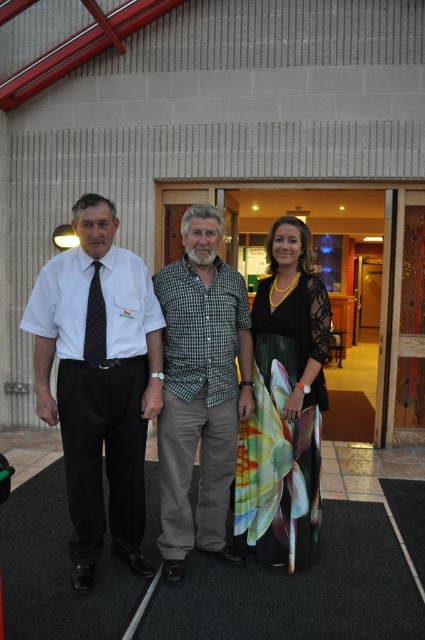
You are planning to take a photo of the group. The camera has a 1.2 meter wide frame. The white shirt at left and the floral silk dress at center are the main subjects. Based on their widths, will both fit within the frame if positioned side by side?

The white shirt at left might be wider than the floral silk dress at center, so their combined width could exceed the camera frame of 1.2 meters. It is uncertain if they will fit without overlapping or cropping.

You are a photographer setting up for a group photo. You notice the green checkered shirt at center and the floral silk dress at center. Which clothing item should you adjust to ensure both are fully visible in the photo?

The green checkered shirt at center is in front of the floral silk dress at center, so you should move the green checkered shirt at center slightly backward to allow both to be fully visible.